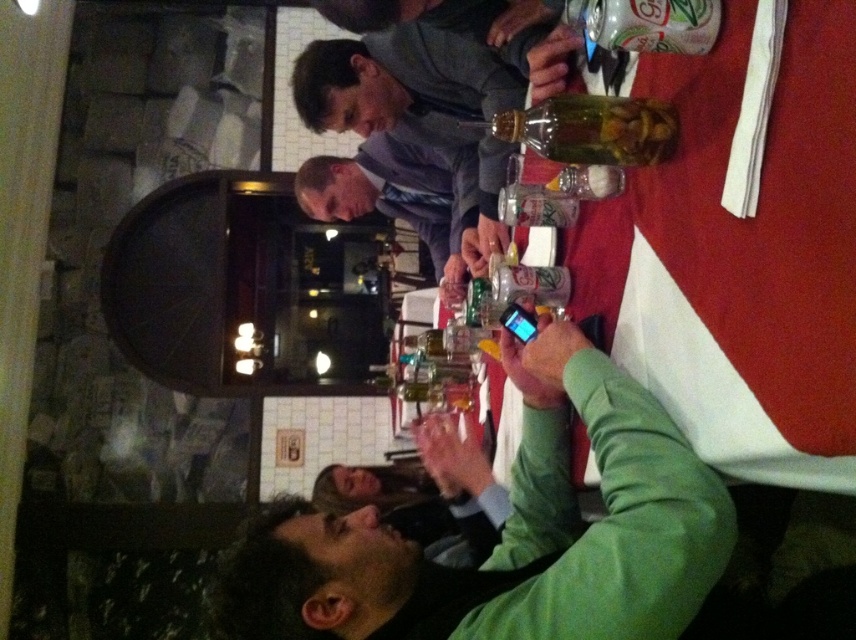
Based on the photo, you are setting up a display on a table and need to place both the green matte phone at center and the translucent glass bottle at upper right. Since space is limited, which object should you prioritize placing first to ensure both fit on the table?

The green matte phone at center has a larger width than the translucent glass bottle at upper right, so you should prioritize placing the green matte phone at center first to ensure both fit on the table.